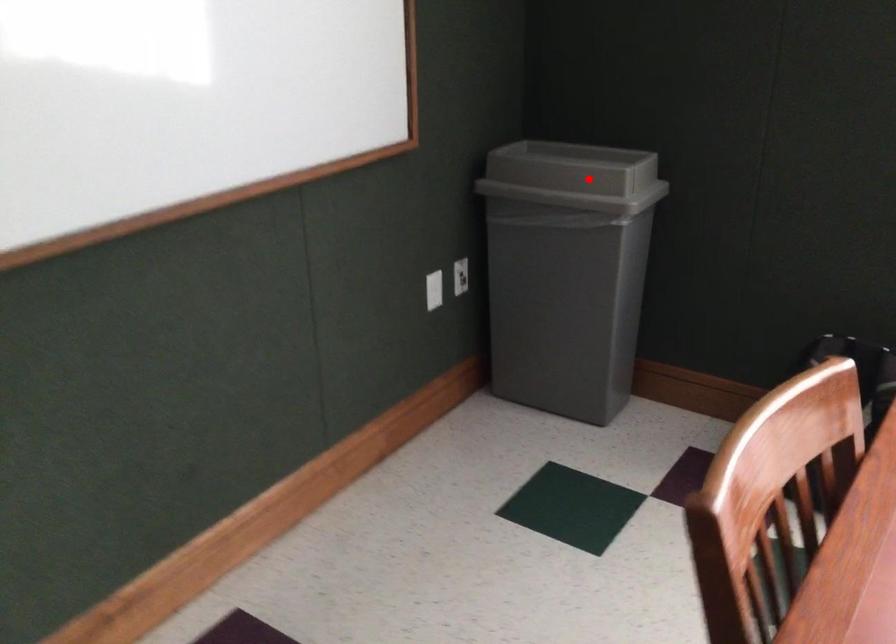
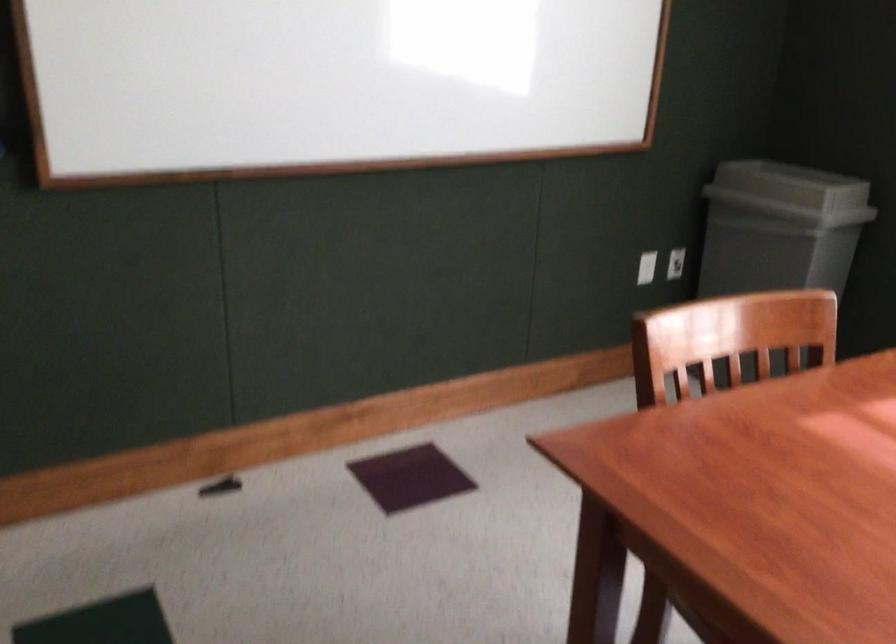
Where in the second image is the point corresponding to the highlighted location from the first image?

(791, 185)